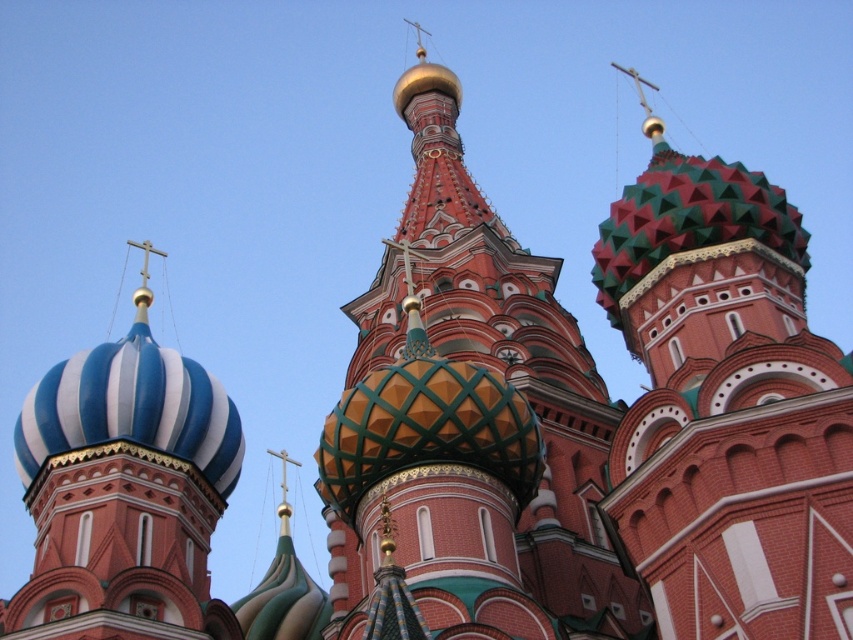
Between multicolored mosaic dome at center and blue and white striped dome at left, which one appears on the left side from the viewer's perspective?

blue and white striped dome at left is more to the left.

Who is more forward, (x=515, y=486) or (x=50, y=451)?

Point (x=515, y=486) is more forward.

I want to click on multicolored mosaic dome at center, so click(467, 428).

Between green and red mosaic dome at center and blue and white striped dome at left, which one has more height?

green and red mosaic dome at center is taller.

Which is in front, point (675, 618) or point (157, 616)?

Positioned in front is point (675, 618).

Locate an element on the screen. Image resolution: width=853 pixels, height=640 pixels. green and red mosaic dome at center is located at coordinates (724, 406).

Between multicolored mosaic dome at center and green and red mosaic dome at center, which one appears on the right side from the viewer's perspective?

Positioned to the right is green and red mosaic dome at center.

Is multicolored mosaic dome at center smaller than green and red mosaic dome at center?

Indeed, multicolored mosaic dome at center has a smaller size compared to green and red mosaic dome at center.

Image resolution: width=853 pixels, height=640 pixels. What do you see at coordinates (467, 428) in the screenshot? I see `multicolored mosaic dome at center` at bounding box center [467, 428].

Locate an element on the screen. This screenshot has height=640, width=853. multicolored mosaic dome at center is located at coordinates (467, 428).